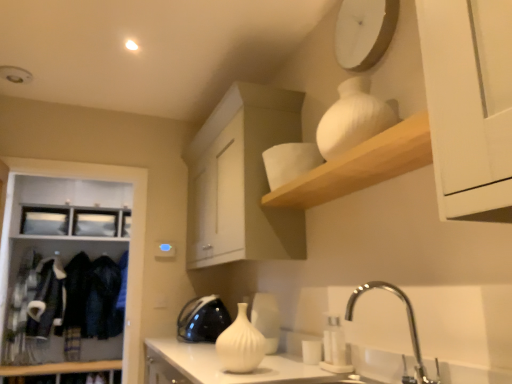
Where is `white matte vase at upper center`? white matte vase at upper center is located at coordinates (360, 166).

The width and height of the screenshot is (512, 384). I want to click on black glossy kettle at center, acting as the 2th appliance starting from the front, so click(x=202, y=319).

Image resolution: width=512 pixels, height=384 pixels. What do you see at coordinates (202, 319) in the screenshot?
I see `black glossy kettle at center, the 2th appliance from the right` at bounding box center [202, 319].

The height and width of the screenshot is (384, 512). What are the coordinates of `white ribbed vase at upper right, placed as the first glass vase when sorted from right to left` in the screenshot? It's located at (353, 118).

Where is `white matte clock at upper center`? The height and width of the screenshot is (384, 512). white matte clock at upper center is located at coordinates (364, 32).

Image resolution: width=512 pixels, height=384 pixels. Describe the element at coordinates (131, 237) in the screenshot. I see `white wood cabinet at left, which ranks as the 2th cabinetry in front-to-back order` at that location.

Describe the element at coordinates (408, 324) in the screenshot. This screenshot has height=384, width=512. I see `polished chrome faucet at lower right` at that location.

What is the approximate width of white matte cabinet at upper center, the first cabinetry viewed from the front?

15.75 inches.

Identify the location of white matte vase at upper center. The height and width of the screenshot is (384, 512). (360, 166).

Could you tell me if white ribbed vase at center, the second glass vase when ordered from top to bottom, is facing white wood cabinet at left, the second cabinetry in the right-to-left sequence?

No, white ribbed vase at center, the second glass vase when ordered from top to bottom, is not aimed at white wood cabinet at left, the second cabinetry in the right-to-left sequence.

Considering the sizes of objects white ribbed vase at center, the 1th glass vase from the left, and white wood cabinet at left, the 1th cabinetry when ordered from back to front, in the image provided, who is thinner, white ribbed vase at center, the 1th glass vase from the left, or white wood cabinet at left, the 1th cabinetry when ordered from back to front,?

Thinner between the two is white ribbed vase at center, the 1th glass vase from the left.

How different are the orientations of white ribbed vase at center, the second glass vase when ordered from top to bottom, and white wood cabinet at left, the 1th cabinetry when ordered from left to right, in degrees?

90.9 degrees.

From a real-world perspective, is white ribbed vase at center, the second glass vase when ordered from top to bottom, under white wood cabinet at left, which ranks as the 2th cabinetry in front-to-back order?

Yes, from a real-world perspective, white ribbed vase at center, the second glass vase when ordered from top to bottom, is under white wood cabinet at left, which ranks as the 2th cabinetry in front-to-back order.

From the image's perspective, is white glossy vase at center, the 1th appliance viewed from the right, over white matte cabinet at upper center, the second cabinetry from the back?

No.

How much distance is there between white glossy vase at center, marked as the 1th appliance in a front-to-back arrangement, and white matte cabinet at upper center, the second cabinetry from the back?

white glossy vase at center, marked as the 1th appliance in a front-to-back arrangement, and white matte cabinet at upper center, the second cabinetry from the back, are 26.35 inches apart.

Does white glossy vase at center, the 1th appliance viewed from the right, lie behind white matte cabinet at upper center, the second cabinetry from the back?

Yes, it is.

In terms of size, does white glossy vase at center, the 2th appliance positioned from the left, appear bigger or smaller than white matte cabinet at upper center, the second cabinetry from the back?

white glossy vase at center, the 2th appliance positioned from the left, is smaller than white matte cabinet at upper center, the second cabinetry from the back.

Which object is positioned more to the right, fuzzy black jacket at left or black glossy kettle at center, which is the 1th appliance in left-to-right order?

From the viewer's perspective, black glossy kettle at center, which is the 1th appliance in left-to-right order, appears more on the right side.

Looking at this image, from a real-world perspective, between fuzzy black jacket at left and black glossy kettle at center, the 2th appliance from the right, who is vertically higher?

From a 3D spatial view, fuzzy black jacket at left is above.

From the image's perspective, which one is positioned higher, white ribbed vase at center, which appears as the 1th glass vase when ordered from the bottom, or white glossy vase at center?

white ribbed vase at center, which appears as the 1th glass vase when ordered from the bottom, is shown above in the image.

Could you tell me if white ribbed vase at center, the 2th glass vase when ordered from right to left, is facing white glossy vase at center?

No, white ribbed vase at center, the 2th glass vase when ordered from right to left, is not turned towards white glossy vase at center.

Based on the photo, considering the sizes of objects white ribbed vase at center, the 1th glass vase from the left, and white glossy vase at center in the image provided, who is shorter, white ribbed vase at center, the 1th glass vase from the left, or white glossy vase at center?

white ribbed vase at center, the 1th glass vase from the left, is shorter.

In the image, is white ribbed vase at center, the second glass vase when ordered from top to bottom, on the left side or the right side of fuzzy black jacket at left?

In the image, white ribbed vase at center, the second glass vase when ordered from top to bottom, appears on the right side of fuzzy black jacket at left.

Is point (253, 359) farther from viewer compared to point (57, 302)?

No, it is not.

Is white ribbed vase at center, the 2th glass vase when ordered from right to left, taller or shorter than fuzzy black jacket at left?

white ribbed vase at center, the 2th glass vase when ordered from right to left, is shorter than fuzzy black jacket at left.

Considering the sizes of objects black glossy kettle at center, which ranks as the first appliance in back-to-front order, and white glossy vase at center in the image provided, who is shorter, black glossy kettle at center, which ranks as the first appliance in back-to-front order, or white glossy vase at center?

With less height is black glossy kettle at center, which ranks as the first appliance in back-to-front order.

What are the coordinates of `the 2nd appliance behind the white glossy vase at center` in the screenshot? It's located at (202, 319).

Considering the sizes of black glossy kettle at center, the 2th appliance from the right, and white glossy vase at center in the image, is black glossy kettle at center, the 2th appliance from the right, wider or thinner than white glossy vase at center?

In the image, black glossy kettle at center, the 2th appliance from the right, appears to be more narrow than white glossy vase at center.

From the image's perspective, between black glossy kettle at center, acting as the 2th appliance starting from the front, and white glossy vase at center, who is located below?

white glossy vase at center is shown below in the image.

Looking at this image, who is shorter, white wood cabinet at left, the 1th cabinetry when ordered from back to front, or white matte cabinet at upper center, the second cabinetry from the back?

Standing shorter between the two is white matte cabinet at upper center, the second cabinetry from the back.

Based on the photo, considering the relative sizes of white wood cabinet at left, the second cabinetry in the right-to-left sequence, and white matte cabinet at upper center, the second cabinetry from the left, in the image provided, is white wood cabinet at left, the second cabinetry in the right-to-left sequence, wider than white matte cabinet at upper center, the second cabinetry from the left,?

Indeed, white wood cabinet at left, the second cabinetry in the right-to-left sequence, has a greater width compared to white matte cabinet at upper center, the second cabinetry from the left.

This screenshot has width=512, height=384. I want to click on cabinetry on the left of white matte cabinet at upper center, the second cabinetry from the left, so click(x=131, y=237).

From a real-world perspective, who is located higher, white wood cabinet at left, which ranks as the 2th cabinetry in front-to-back order, or white matte cabinet at upper center, the second cabinetry from the back?

white matte cabinet at upper center, the second cabinetry from the back, from a real-world perspective.

At what (x,y) coordinates should I click in order to perform the action: click on cabinetry that appears below the white ribbed vase at center, which appears as the 1th glass vase when ordered from the bottom (from the image's perspective). Please return your answer as a coordinate pair (x, y). Image resolution: width=512 pixels, height=384 pixels. Looking at the image, I should click on (131, 237).

There is a white glossy vase at center, arranged as the second appliance when viewed from the back. Where is `the 2nd cabinetry above it (from a real-world perspective)`? This screenshot has height=384, width=512. the 2nd cabinetry above it (from a real-world perspective) is located at coordinates (242, 179).

When comparing their distances from white ribbed vase at upper right, arranged as the second glass vase when ordered from the bottom, does fuzzy black jacket at left or white ribbed vase at center, the 1th glass vase from the left, seem closer?

Among the two, white ribbed vase at center, the 1th glass vase from the left, is located nearer to white ribbed vase at upper right, arranged as the second glass vase when ordered from the bottom.

From the image, which object appears to be farther from white glossy vase at center, arranged as the second appliance when viewed from the back, white matte vase at upper center or white matte cabinet at upper center, the second cabinetry from the left?

Among the two, white matte vase at upper center is located further to white glossy vase at center, arranged as the second appliance when viewed from the back.

When comparing their distances from white matte clock at upper center, does black glossy kettle at center, the 2th appliance from the right, or white glossy vase at center seem closer?

white glossy vase at center is positioned closer to the anchor white matte clock at upper center.

Estimate the real-world distances between objects in this image. Which object is further from black glossy kettle at center, the 2th appliance from the right, white wood cabinet at left, the 1th cabinetry when ordered from left to right, or polished chrome faucet at lower right?

polished chrome faucet at lower right is positioned further to the anchor black glossy kettle at center, the 2th appliance from the right.

From the image, which object appears to be nearer to white wood cabinet at left, which ranks as the 2th cabinetry in front-to-back order, white matte cabinet at upper center, the second cabinetry from the left, or black glossy kettle at center, acting as the 2th appliance starting from the front?

Based on the image, black glossy kettle at center, acting as the 2th appliance starting from the front, appears to be nearer to white wood cabinet at left, which ranks as the 2th cabinetry in front-to-back order.

Looking at the image, which one is located closer to polished chrome faucet at lower right, white ribbed vase at upper right, arranged as the second glass vase when ordered from the bottom, or white ribbed vase at center, the second glass vase when ordered from top to bottom?

white ribbed vase at center, the second glass vase when ordered from top to bottom, is positioned closer to the anchor polished chrome faucet at lower right.

Consider the image. Which object lies further to the anchor point fuzzy black jacket at left, white glossy vase at center, marked as the 1th appliance in a front-to-back arrangement, or black glossy kettle at center, the 2th appliance from the right?

white glossy vase at center, marked as the 1th appliance in a front-to-back arrangement, lies further to fuzzy black jacket at left than the other object.

Looking at the image, which one is located closer to white ribbed vase at upper right, placed as the first glass vase when sorted from right to left, white ribbed vase at center, the 2th glass vase when ordered from right to left, or polished chrome faucet at lower right?

polished chrome faucet at lower right.

Find the location of a particular element. The height and width of the screenshot is (384, 512). cabinetry between white matte clock at upper center and white ribbed vase at center, the 1th glass vase from the left, vertically is located at coordinates (242, 179).

I want to click on tap positioned between white matte vase at upper center and fuzzy black jacket at left from near to far, so click(408, 324).

Locate an element on the screen. Image resolution: width=512 pixels, height=384 pixels. glass vase between white matte vase at upper center and white glossy vase at center in the vertical direction is located at coordinates (240, 344).

Where is `countertop between white matte vase at upper center and white wood cabinet at left, the 1th cabinetry when ordered from left to right, from front to back`? This screenshot has height=384, width=512. countertop between white matte vase at upper center and white wood cabinet at left, the 1th cabinetry when ordered from left to right, from front to back is located at coordinates (218, 366).